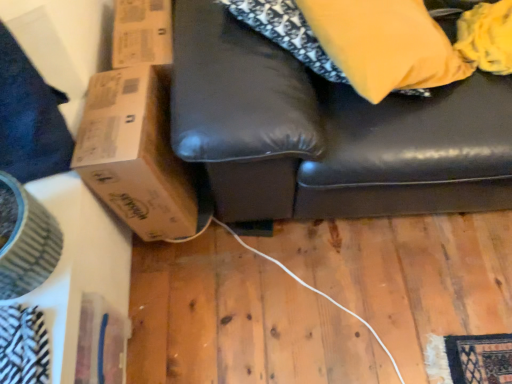
Question: From the image's perspective, is brown cardboard box at left over matte yellow pillow at upper right?

Choices:
 (A) yes
 (B) no

Answer: (B)

Question: Does brown cardboard box at left lie in front of matte yellow pillow at upper right?

Choices:
 (A) yes
 (B) no

Answer: (B)

Question: Is brown cardboard box at left oriented towards matte yellow pillow at upper right?

Choices:
 (A) no
 (B) yes

Answer: (A)

Question: Can you confirm if brown cardboard box at left is taller than matte yellow pillow at upper right?

Choices:
 (A) no
 (B) yes

Answer: (B)

Question: Can you confirm if brown cardboard box at left is bigger than matte yellow pillow at upper right?

Choices:
 (A) no
 (B) yes

Answer: (B)

Question: In terms of size, does matte yellow pillow at upper right appear bigger or smaller than brown cardboard box at left?

Choices:
 (A) big
 (B) small

Answer: (B)

Question: In the image, is matte yellow pillow at upper right positioned in front of or behind brown cardboard box at left?

Choices:
 (A) behind
 (B) front

Answer: (B)

Question: Would you say matte yellow pillow at upper right is inside or outside brown cardboard box at left?

Choices:
 (A) inside
 (B) outside

Answer: (B)

Question: From the image's perspective, is matte yellow pillow at upper right located above or below brown cardboard box at left?

Choices:
 (A) below
 (B) above

Answer: (B)

Question: Looking at the image, does brown cardboard box at left seem bigger or smaller compared to wooden floor at lower center?

Choices:
 (A) small
 (B) big

Answer: (B)

Question: Considering the positions of point (117, 190) and point (179, 340), is point (117, 190) closer or farther from the camera than point (179, 340)?

Choices:
 (A) closer
 (B) farther

Answer: (A)

Question: From a real-world perspective, is brown cardboard box at left above or below wooden floor at lower center?

Choices:
 (A) above
 (B) below

Answer: (A)

Question: Is brown cardboard box at left spatially inside wooden floor at lower center, or outside of it?

Choices:
 (A) inside
 (B) outside

Answer: (B)

Question: In terms of width, does brown cardboard box at left look wider or thinner when compared to matte yellow pillow at upper right?

Choices:
 (A) wide
 (B) thin

Answer: (A)

Question: Looking at the image, does brown cardboard box at left seem bigger or smaller compared to matte yellow pillow at upper right?

Choices:
 (A) big
 (B) small

Answer: (A)